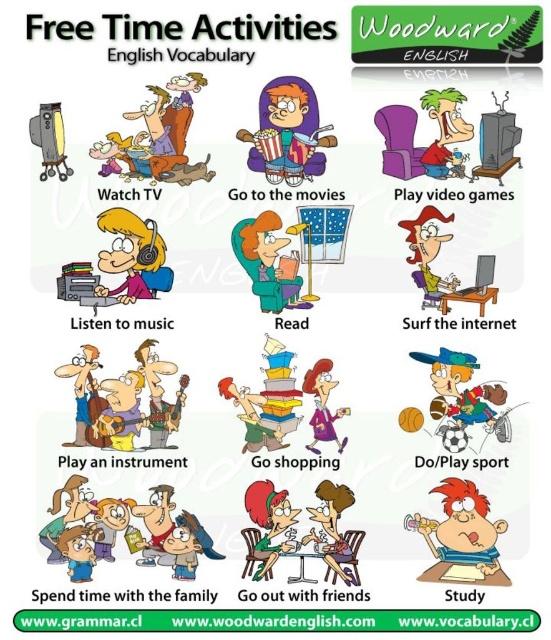
Who is taller, matte orange shirt at center or matte yellow book at center?

With more height is matte orange shirt at center.

Does matte orange shirt at center appear over matte yellow book at center?

Yes, matte orange shirt at center is above matte yellow book at center.

Measure the distance between matte orange shirt at center and camera.

A distance of 1.37 meters exists between matte orange shirt at center and camera.

At what (x,y) coordinates should I click in order to perform the action: click on matte orange shirt at center. Please return your answer as a coordinate pair (x, y). Looking at the image, I should click on (288, 132).

Which is in front, point (300, 280) or point (435, 296)?

Positioned in front is point (435, 296).

Locate an element on the screen. matte yellow book at center is located at coordinates (267, 262).

Which is above, matte yellow shirt at center or matte purple shirt at center?

matte yellow shirt at center is above.

Where is `matte yellow shirt at center`? matte yellow shirt at center is located at coordinates (428, 253).